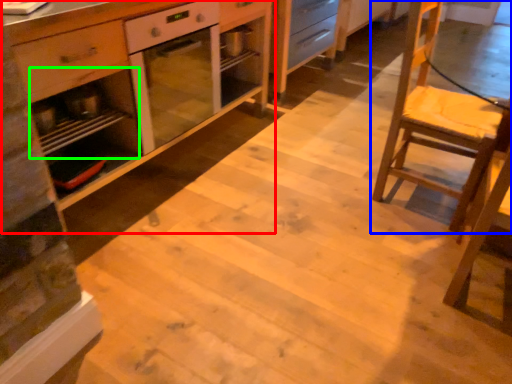
Question: Which object is positioned closest to cabinetry (highlighted by a red box)? Select from chair (highlighted by a blue box) and shelf (highlighted by a green box).

Choices:
 (A) chair
 (B) shelf

Answer: (B)